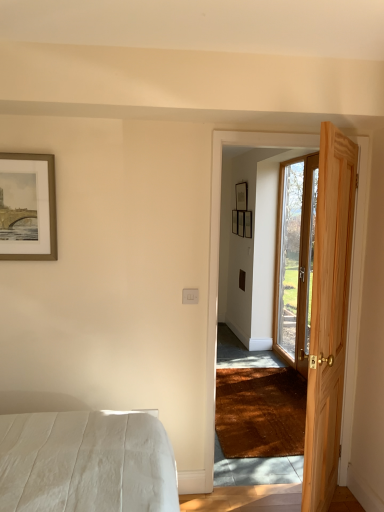
Question: In the image, is clear glass door at right, acting as the first door starting from the right, positioned in front of or behind wooden picture frame at center, which is counted as the 2th picture frame, starting from the front?

Choices:
 (A) behind
 (B) front

Answer: (B)

Question: In terms of size, does clear glass door at right, which appears as the second door when viewed from the front, appear bigger or smaller than wooden picture frame at center, arranged as the 2th picture frame when viewed from the back?

Choices:
 (A) small
 (B) big

Answer: (B)

Question: Which is nearer to the clear glass door at right, arranged as the first door when viewed from the back?

Choices:
 (A) matte black picture frame at upper center, which ranks as the third picture frame in front-to-back order
 (B) natural wood door at right, positioned as the first door in front-to-back order
 (C) wooden picture frame at center, which is counted as the third picture frame, starting from the left
 (D) gold-framed artwork at upper left, the 1th picture frame in the front-to-back sequence

Answer: (C)

Question: Which is nearer to the clear glass door at right, which is the 2th door from left to right?

Choices:
 (A) natural wood door at right, acting as the second door starting from the back
 (B) gold-framed artwork at upper left, which ranks as the first picture frame in left-to-right order
 (C) matte black picture frame at upper center, arranged as the second picture frame when viewed from the right
 (D) wooden picture frame at center, arranged as the 1th picture frame when viewed from the right

Answer: (D)